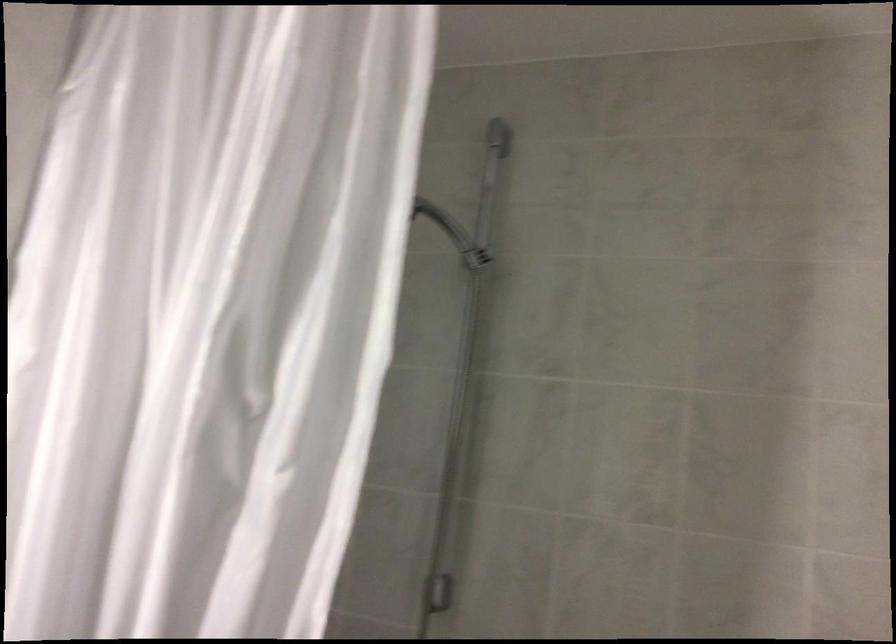
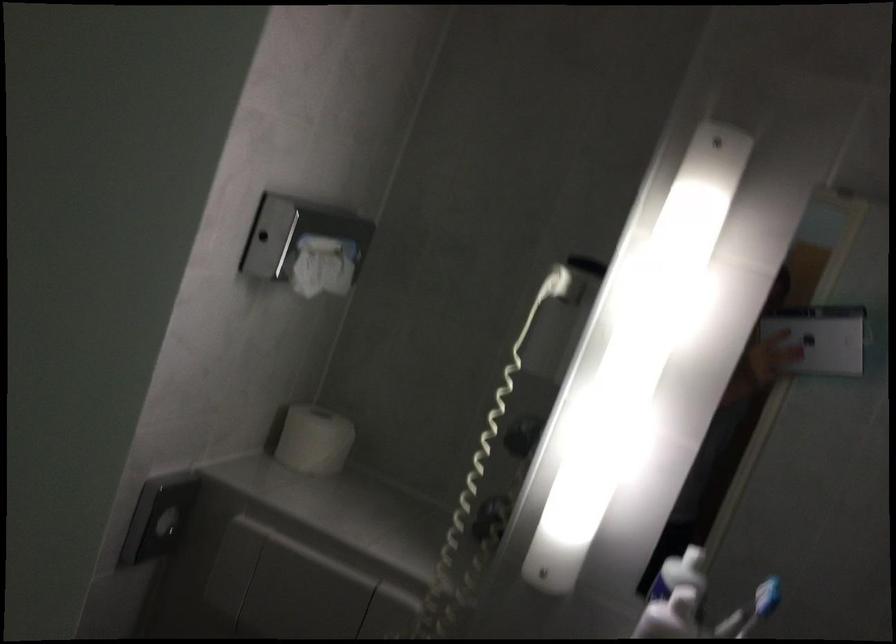
Question: Based on the continuous images, in which direction is the camera rotating? Reply with the corresponding letter.

Choices:
 (A) Left
 (B) Right
 (C) Up
 (D) Down

Answer: (A)